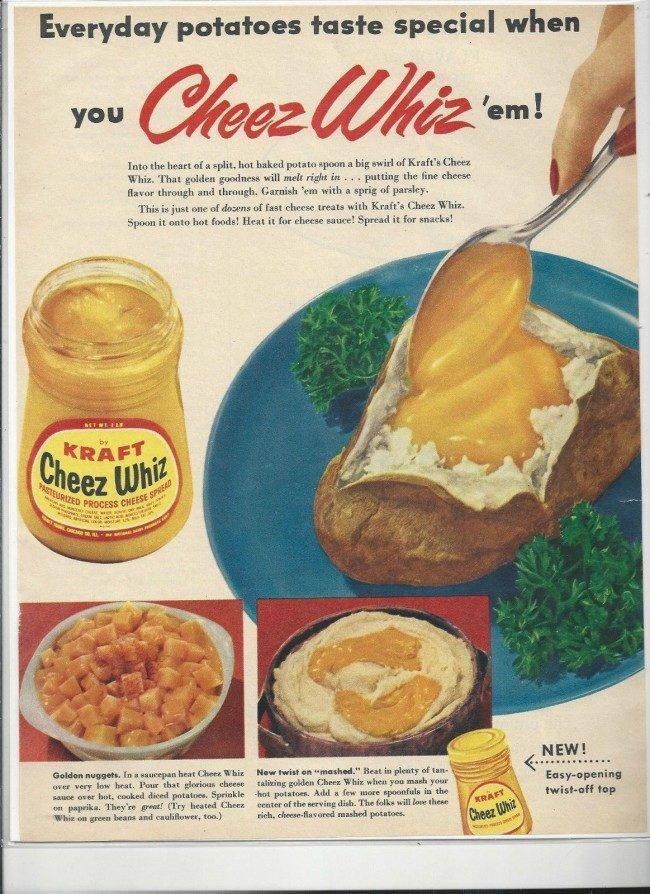
Locate an element on the screen. This screenshot has width=650, height=894. spoon is located at coordinates tap(538, 215).